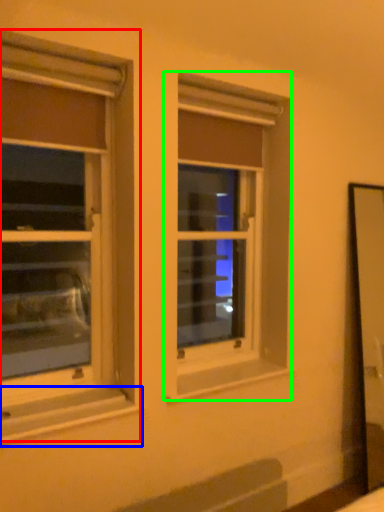
Question: Based on their relative distances, which object is farther from window (highlighted by a red box)? Choose from window sill (highlighted by a blue box) and window (highlighted by a green box).

Choices:
 (A) window sill
 (B) window

Answer: (A)